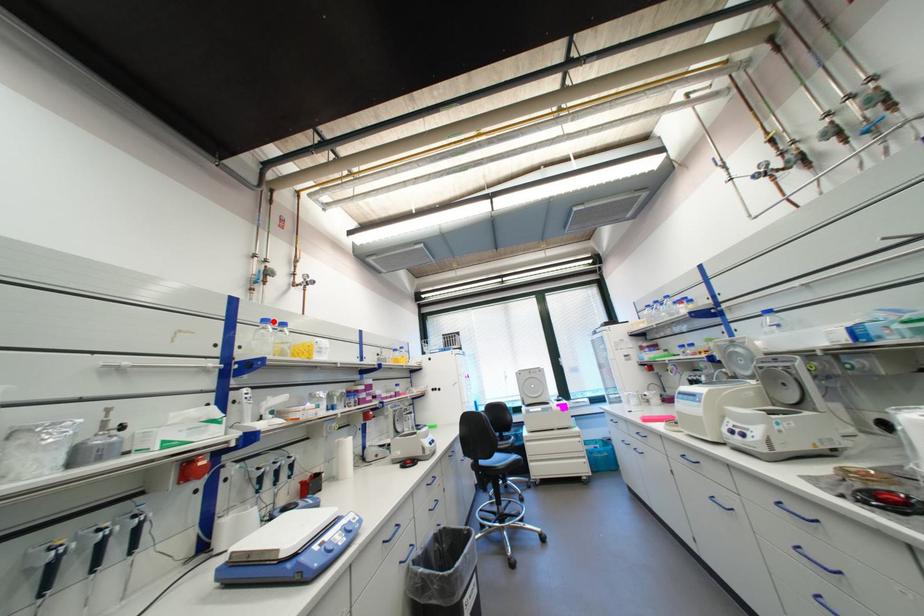
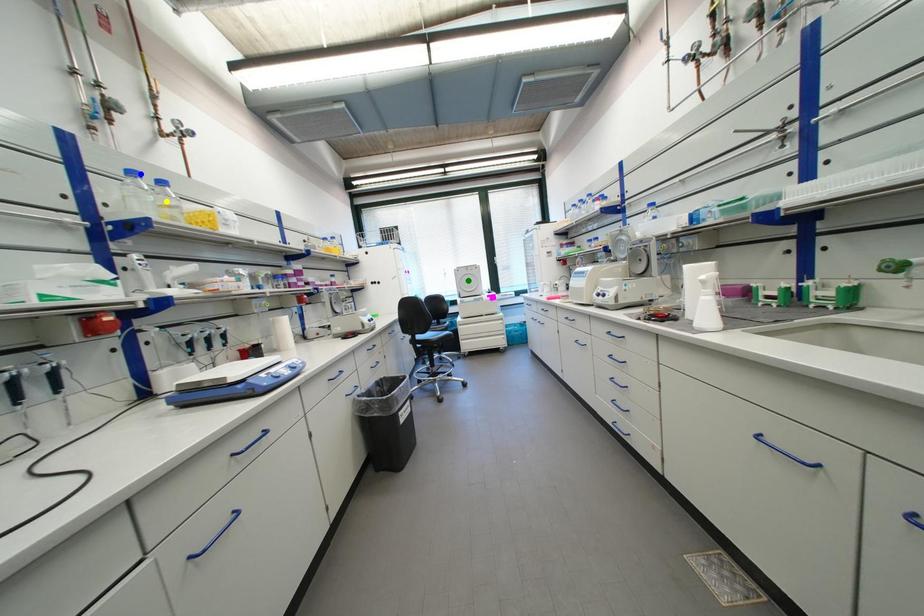
Question: I am providing you with two images of the same scene from different viewpoints. A red point is marked on the first image. You are given multiple points on the second image. Which spot in image 2 lines up with the point in image 1?

Choices:
 (A) blue point
 (B) green point
 (C) yellow point

Answer: (A)